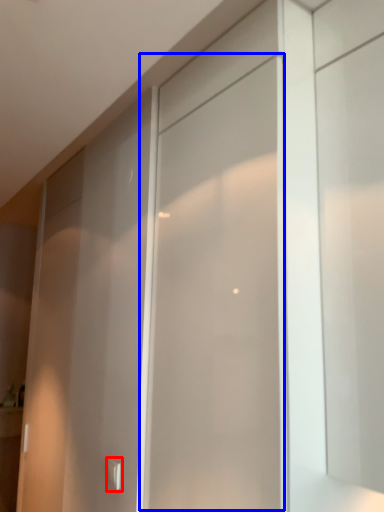
Question: Which object appears closest to the camera in this image, door handle (highlighted by a red box) or screen door (highlighted by a blue box)?

Choices:
 (A) door handle
 (B) screen door

Answer: (B)